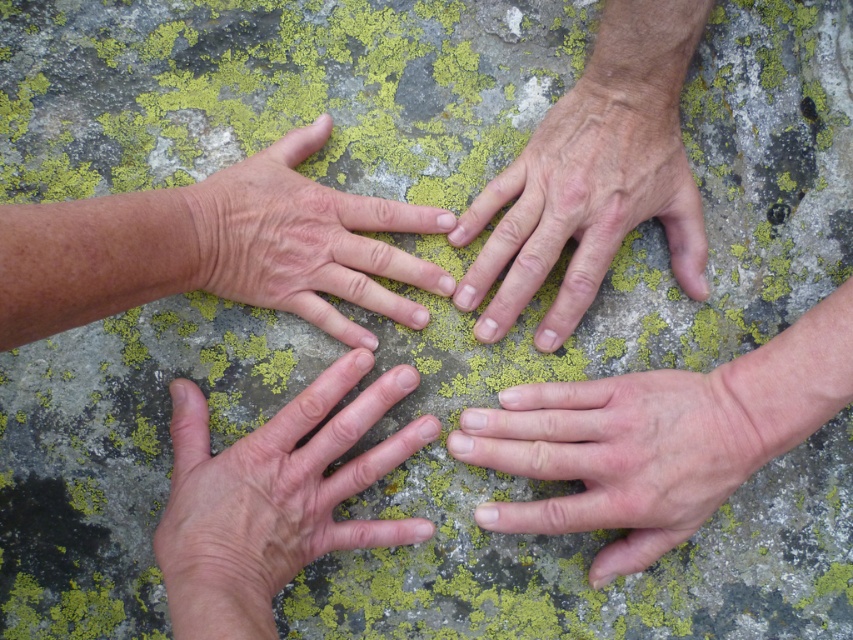
Question: Estimate the real-world distances between objects in this image. Which object is closer to the dry skin hand at upper center?

Choices:
 (A) pale skin hand at lower right
 (B) dry skin hand at center

Answer: (A)

Question: Can you confirm if dry skin hand at lower left is bigger than pale skin hand at lower right?

Choices:
 (A) yes
 (B) no

Answer: (A)

Question: Can you confirm if pale skin hand at lower right is positioned below dry skin hand at upper center?

Choices:
 (A) yes
 (B) no

Answer: (A)

Question: Is dry skin hand at lower left further to the viewer compared to pale skin hand at lower right?

Choices:
 (A) no
 (B) yes

Answer: (A)

Question: Which object is positioned farthest from the dry skin hand at lower left?

Choices:
 (A) dry skin hand at center
 (B) pale skin hand at lower right

Answer: (B)

Question: Which of the following is the closest to the observer?

Choices:
 (A) (277, 179)
 (B) (155, 554)
 (C) (563, 216)
 (D) (556, 522)

Answer: (B)